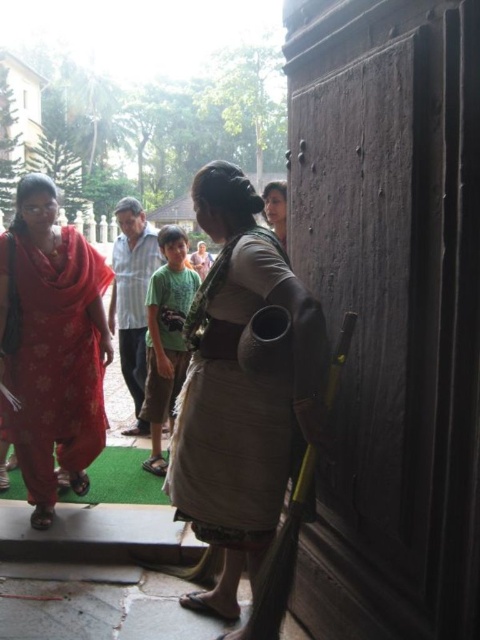
Question: Which object is the farthest from the dark wood door at right?

Choices:
 (A) floral fabric sari at left
 (B) brown woven cloth at center

Answer: (A)

Question: Among these objects, which one is nearest to the camera?

Choices:
 (A) floral fabric sari at left
 (B) dark wood door at right
 (C) brown woven cloth at center

Answer: (B)

Question: Is dark wood door at right to the left of brown woven cloth at center from the viewer's perspective?

Choices:
 (A) yes
 (B) no

Answer: (B)

Question: Which point appears farthest from the camera in this image?

Choices:
 (A) (10, 234)
 (B) (193, 412)

Answer: (A)

Question: Is brown woven cloth at center positioned at the back of floral fabric sari at left?

Choices:
 (A) no
 (B) yes

Answer: (A)

Question: From the image, what is the correct spatial relationship of brown woven cloth at center in relation to floral fabric sari at left?

Choices:
 (A) below
 (B) above

Answer: (A)